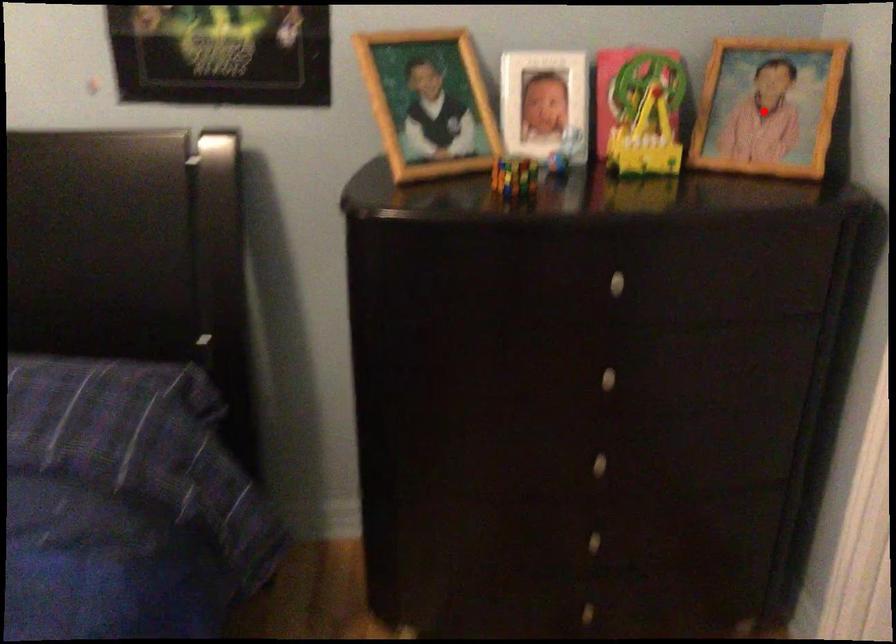
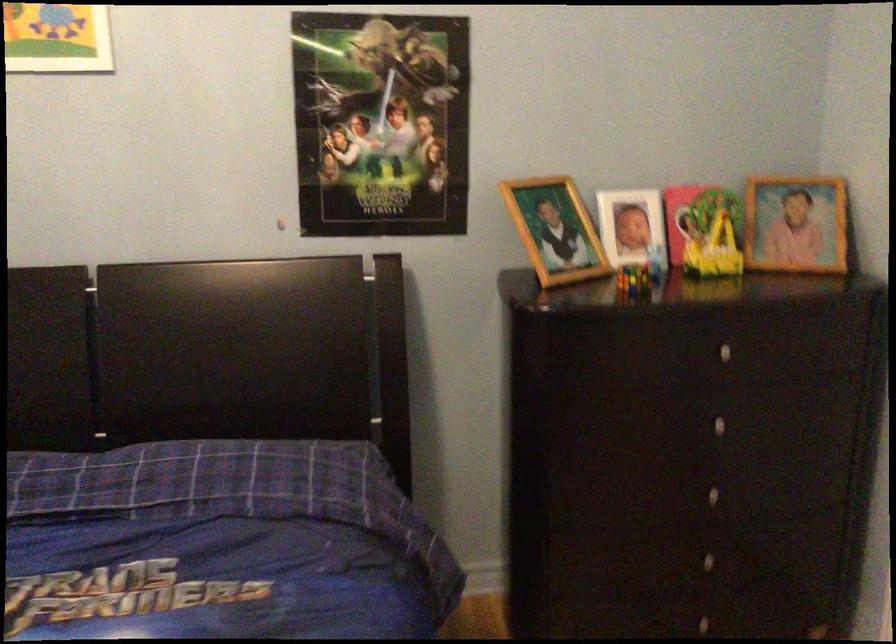
Locate, in the second image, the point that corresponds to the highlighted location in the first image.

(796, 223)